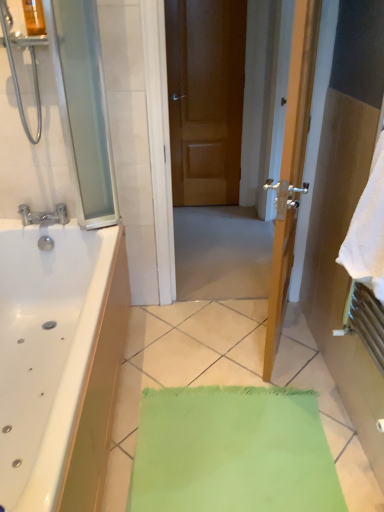
Question: From a real-world perspective, is transparent glass screen door at left physically located above or below brown wooden door at center?

Choices:
 (A) above
 (B) below

Answer: (A)

Question: Based on their sizes in the image, would you say transparent glass screen door at left is bigger or smaller than brown wooden door at center?

Choices:
 (A) small
 (B) big

Answer: (A)

Question: Based on their relative distances, which object is farther from the transparent glass screen door at left?

Choices:
 (A) brushed metal shower at upper left
 (B) matte silver faucet at left
 (C) white soft towel at right
 (D) brown wooden door at center

Answer: (D)

Question: Which object is the farthest from the matte silver faucet at left?

Choices:
 (A) white soft towel at right
 (B) transparent glass screen door at left
 (C) brown wooden door at center
 (D) brushed metal shower at upper left

Answer: (C)